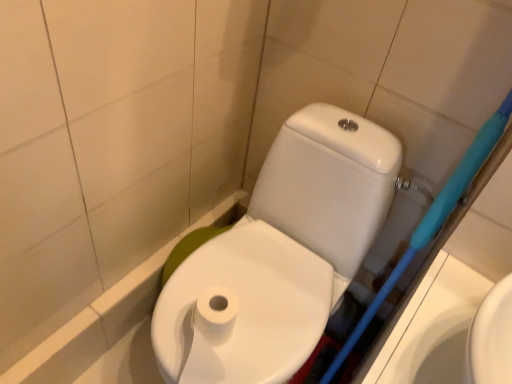
At what (x,y) coordinates should I click in order to perform the action: click on white glossy toilet at center. Please return your answer as a coordinate pair (x, y). The height and width of the screenshot is (384, 512). Looking at the image, I should click on (282, 253).

What do you see at coordinates (282, 253) in the screenshot? I see `white glossy toilet at center` at bounding box center [282, 253].

At what (x,y) coordinates should I click in order to perform the action: click on white glossy toilet at center. Please return your answer as a coordinate pair (x, y). Image resolution: width=512 pixels, height=384 pixels. Looking at the image, I should click on (282, 253).